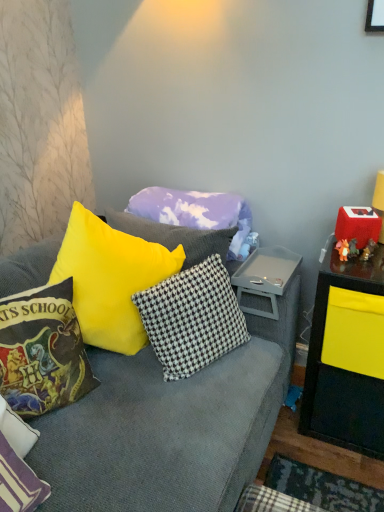
Question: Is velvet harry potter-themed pillow at left, which ranks as the 2th pillow in front-to-back order, far from white textured pillow at lower left, the 4th pillow when ordered from back to front?

Choices:
 (A) yes
 (B) no

Answer: (B)

Question: Does velvet harry potter-themed pillow at left, which is the 3th pillow from back to front, come behind white textured pillow at lower left, which appears as the 1th pillow when viewed from the front?

Choices:
 (A) no
 (B) yes

Answer: (B)

Question: Is velvet harry potter-themed pillow at left, which ranks as the 2th pillow in front-to-back order, facing away from white textured pillow at lower left, the 4th pillow when ordered from back to front?

Choices:
 (A) yes
 (B) no

Answer: (B)

Question: Does velvet harry potter-themed pillow at left, which is the 3th pillow from back to front, have a larger size compared to white textured pillow at lower left, the 4th pillow when ordered from back to front?

Choices:
 (A) yes
 (B) no

Answer: (A)

Question: Can you confirm if velvet harry potter-themed pillow at left, which ranks as the 2th pillow in front-to-back order, is wider than white textured pillow at lower left, which appears as the 1th pillow when viewed from the front?

Choices:
 (A) no
 (B) yes

Answer: (A)

Question: Considering the positions of white and brown checkered pillow at center, the second pillow when ordered from back to front, and gray plastic tray at center in the image, is white and brown checkered pillow at center, the second pillow when ordered from back to front, bigger or smaller than gray plastic tray at center?

Choices:
 (A) small
 (B) big

Answer: (B)

Question: Is white and brown checkered pillow at center, the second pillow when ordered from back to front, to the left or to the right of gray plastic tray at center in the image?

Choices:
 (A) left
 (B) right

Answer: (A)

Question: From a real-world perspective, is white and brown checkered pillow at center, the second pillow when ordered from back to front, physically located above or below gray plastic tray at center?

Choices:
 (A) above
 (B) below

Answer: (A)

Question: From the image's perspective, is white and brown checkered pillow at center, the second pillow when ordered from back to front, located above or below gray plastic tray at center?

Choices:
 (A) above
 (B) below

Answer: (B)

Question: Is white and brown checkered pillow at center, the second pillow when ordered from back to front, wider or thinner than velvet harry potter-themed pillow at left, which ranks as the 2th pillow in front-to-back order?

Choices:
 (A) wide
 (B) thin

Answer: (B)

Question: In the image, is white and brown checkered pillow at center, which is the 3th pillow in front-to-back order, on the left side or the right side of velvet harry potter-themed pillow at left, which is the 3th pillow from back to front?

Choices:
 (A) left
 (B) right

Answer: (B)

Question: Considering the positions of point (142, 314) and point (71, 288), is point (142, 314) closer or farther from the camera than point (71, 288)?

Choices:
 (A) closer
 (B) farther

Answer: (B)

Question: Based on their sizes in the image, would you say white and brown checkered pillow at center, which is the 3th pillow in front-to-back order, is bigger or smaller than velvet harry potter-themed pillow at left, which ranks as the 2th pillow in front-to-back order?

Choices:
 (A) small
 (B) big

Answer: (B)

Question: Considering the positions of gray plastic tray at center and white and brown checkered pillow at center, which is the 3th pillow in front-to-back order, in the image, is gray plastic tray at center bigger or smaller than white and brown checkered pillow at center, which is the 3th pillow in front-to-back order,?

Choices:
 (A) big
 (B) small

Answer: (B)

Question: Is gray plastic tray at center situated inside white and brown checkered pillow at center, which is the 3th pillow in front-to-back order, or outside?

Choices:
 (A) inside
 (B) outside

Answer: (B)